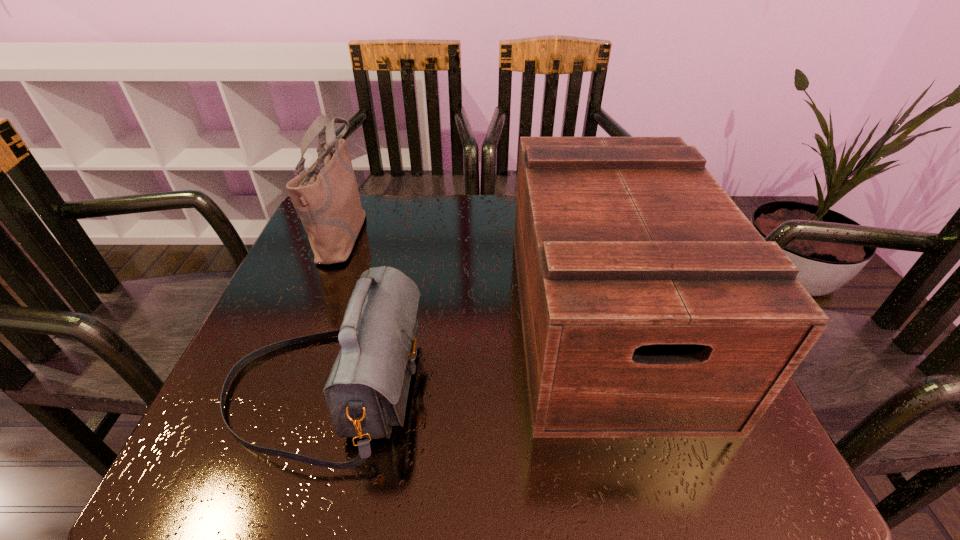
Locate an element on the screen. free space at the near right corner of the desktop is located at coordinates (684, 454).

Find the location of a particular element. The width and height of the screenshot is (960, 540). free point between the nearer shoulder bag and the taller shoulder bag is located at coordinates (334, 311).

The height and width of the screenshot is (540, 960). I want to click on unoccupied area between the taller shoulder bag and the nearer shoulder bag, so click(334, 311).

The width and height of the screenshot is (960, 540). What are the coordinates of `unoccupied area between the box and the nearer shoulder bag` in the screenshot? It's located at (x=465, y=352).

At what (x,y) coordinates should I click in order to perform the action: click on vacant space in between the nearer shoulder bag and the box. Please return your answer as a coordinate pair (x, y). Looking at the image, I should click on (465, 352).

This screenshot has height=540, width=960. Identify the location of empty space that is in between the rightmost object and the shorter shoulder bag. (465, 352).

Image resolution: width=960 pixels, height=540 pixels. Identify the location of vacant area that lies between the taller shoulder bag and the rightmost object. (474, 275).

Identify the location of vacant space that's between the taller shoulder bag and the shortest object. (334, 311).

The image size is (960, 540). I want to click on empty location between the farther shoulder bag and the box, so click(474, 275).

Where is `empty location between the shorter shoulder bag and the box`? empty location between the shorter shoulder bag and the box is located at coordinates (465, 352).